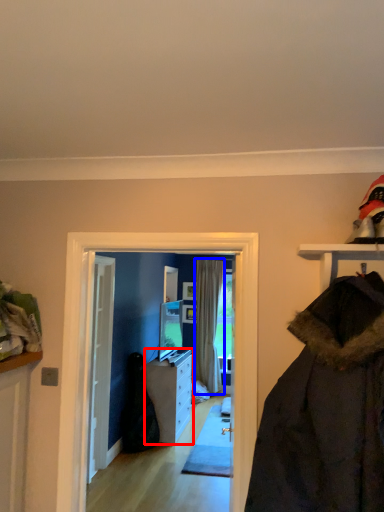
Question: Which point is closer to the camera, cabinetry (highlighted by a red box) or curtain (highlighted by a blue box)?

Choices:
 (A) cabinetry
 (B) curtain

Answer: (A)